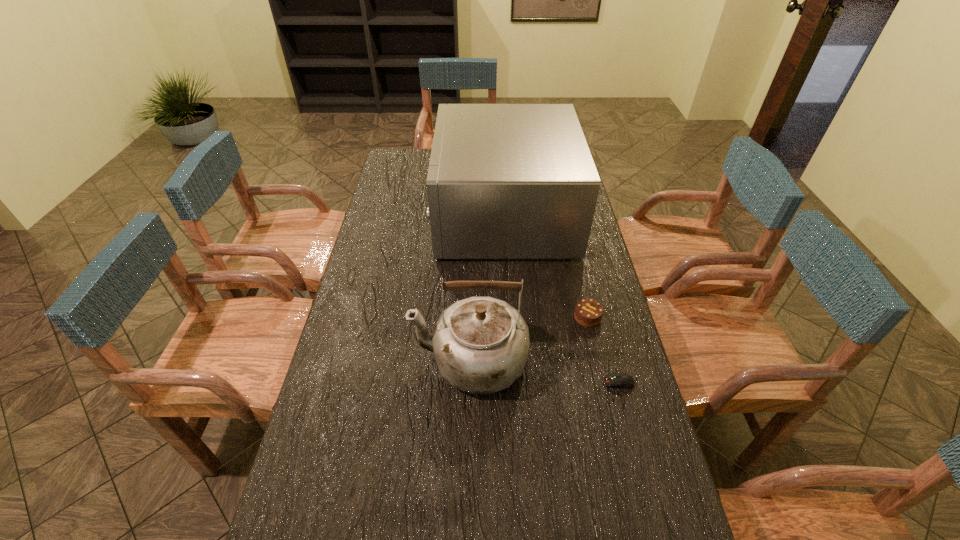
Where is `empty location between the farthest object and the chocolate cake`? Image resolution: width=960 pixels, height=540 pixels. empty location between the farthest object and the chocolate cake is located at coordinates (545, 266).

You are a GUI agent. You are given a task and a screenshot of the screen. Output one action in this format:
    pyautogui.click(x=<x>, y=<y>)
    Task: Click on the free space between the microwave oven and the shortest object
    
    Given the screenshot: What is the action you would take?
    pyautogui.click(x=562, y=298)

Locate an element on the screen. The height and width of the screenshot is (540, 960). free space between the shortest object and the microwave oven is located at coordinates (562, 298).

Where is `free space between the computer equipment and the second shortest object`? free space between the computer equipment and the second shortest object is located at coordinates (603, 350).

I want to click on free area in between the chocolate cake and the farthest object, so click(x=545, y=266).

Image resolution: width=960 pixels, height=540 pixels. I want to click on vacant area between the computer equipment and the chocolate cake, so click(603, 350).

Identify which object is the second closest to the third tallest object. Please provide its 2D coordinates. Your answer should be formatted as a tuple, i.e. [(x, y)], where the tuple contains the x and y coordinates of a point satisfying the conditions above.

[(620, 380)]

Identify which object is located as the second nearest to the chocolate cake. Please provide its 2D coordinates. Your answer should be formatted as a tuple, i.e. [(x, y)], where the tuple contains the x and y coordinates of a point satisfying the conditions above.

[(620, 380)]

The width and height of the screenshot is (960, 540). What are the coordinates of `free point that satisfies the following two spatial constraints: 1. at the spout of the kettle; 2. on the left side of the third tallest object` in the screenshot? It's located at (470, 317).

Find the location of a particular element. free region that satisfies the following two spatial constraints: 1. on the back side of the chocolate cake; 2. with the door open on the farthest object is located at coordinates (564, 214).